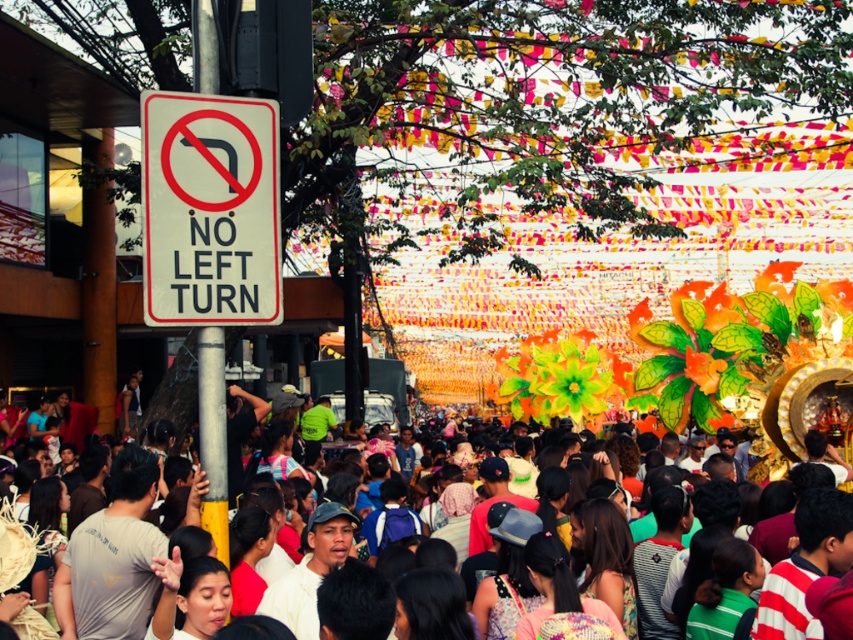
Question: Which point is closer to the camera taking this photo?

Choices:
 (A) (209, 161)
 (B) (769, 556)

Answer: (A)

Question: Which point is closer to the camera?

Choices:
 (A) (831, 448)
 (B) (155, 115)

Answer: (B)

Question: Can you confirm if white plastic sign at upper left is positioned above multicolored fabric crowd at center?

Choices:
 (A) yes
 (B) no

Answer: (A)

Question: Is white plastic sign at upper left to the left of multicolored fabric crowd at center from the viewer's perspective?

Choices:
 (A) no
 (B) yes

Answer: (B)

Question: Is white plastic sign at upper left to the left of multicolored fabric crowd at center from the viewer's perspective?

Choices:
 (A) yes
 (B) no

Answer: (A)